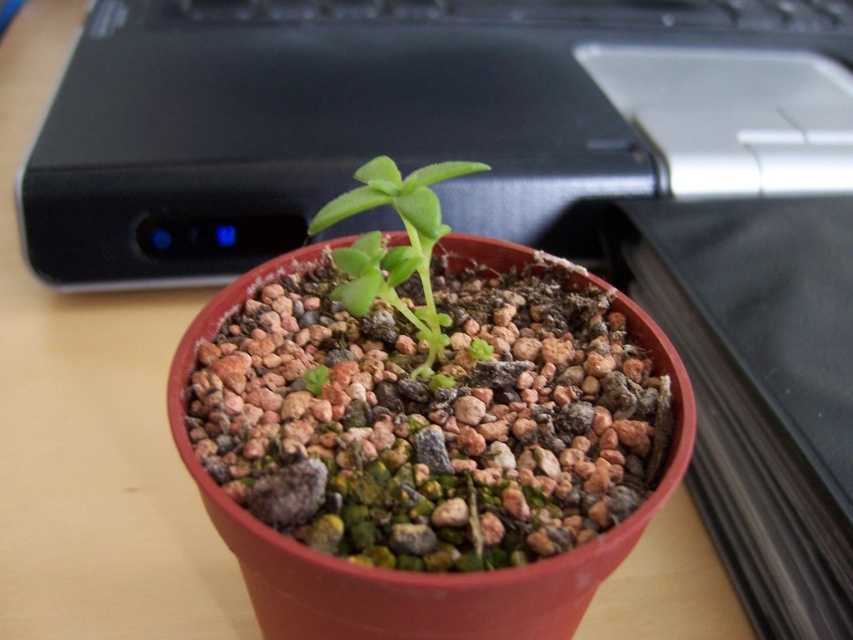
Question: Is black plastic computer at upper center positioned at the back of black plastic keyboard at upper center?

Choices:
 (A) yes
 (B) no

Answer: (B)

Question: Which object is farther from the camera taking this photo?

Choices:
 (A) black plastic computer at upper center
 (B) black plastic keyboard at upper center
 (C) green matte plant at center

Answer: (B)

Question: Among these objects, which one is nearest to the camera?

Choices:
 (A) green matte plant at center
 (B) black plastic computer at upper center
 (C) black plastic keyboard at upper center

Answer: (A)

Question: Which object is positioned farthest from the green matte plant at center?

Choices:
 (A) black plastic keyboard at upper center
 (B) black plastic computer at upper center

Answer: (A)

Question: Is black plastic computer at upper center bigger than black plastic keyboard at upper center?

Choices:
 (A) no
 (B) yes

Answer: (B)

Question: From the image, what is the correct spatial relationship of black plastic computer at upper center in relation to black plastic keyboard at upper center?

Choices:
 (A) below
 (B) above

Answer: (A)